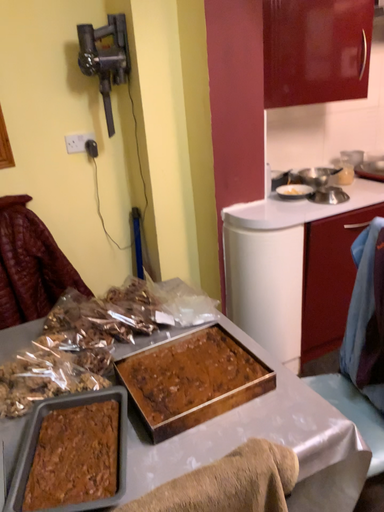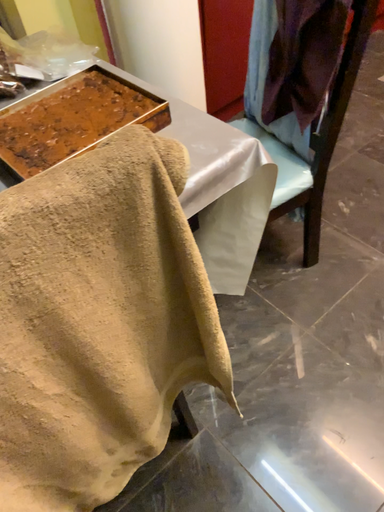
Question: How did the camera likely rotate when shooting the video?

Choices:
 (A) rotated left
 (B) rotated right

Answer: (B)